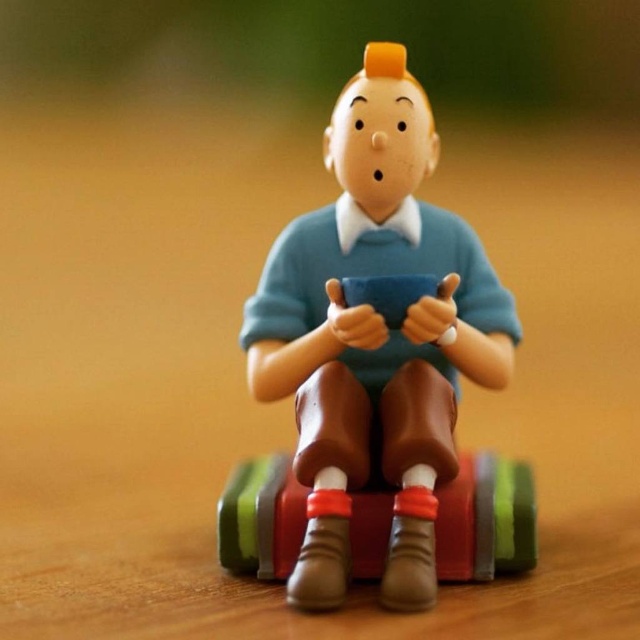
The width and height of the screenshot is (640, 640). What do you see at coordinates (376, 337) in the screenshot?
I see `matte plastic figure at center` at bounding box center [376, 337].

Between point (365, 216) and point (496, 524), which one is positioned behind?

Positioned behind is point (365, 216).

Is point (397, 260) positioned before point (358, 573)?

No, (397, 260) is further to viewer.

The image size is (640, 640). Identify the location of matte plastic figure at center. (376, 337).